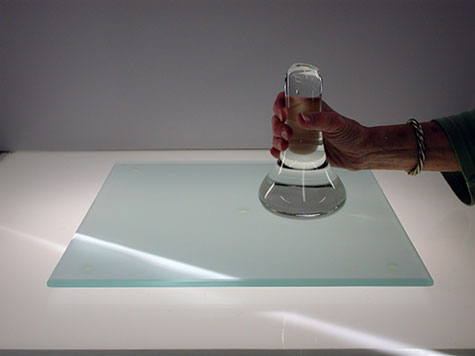
The image size is (475, 356). Identify the location of grey wall. (140, 76).